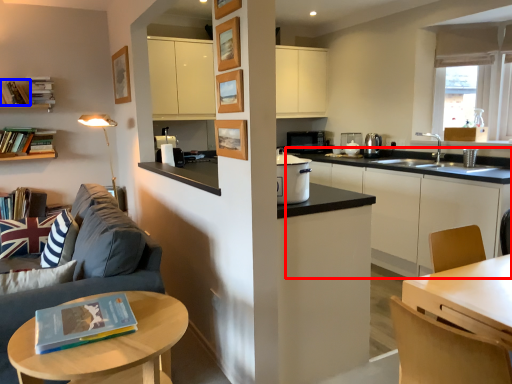
Question: Which object appears farthest to the camera in this image, cabinetry (highlighted by a red box) or book (highlighted by a blue box)?

Choices:
 (A) cabinetry
 (B) book

Answer: (B)